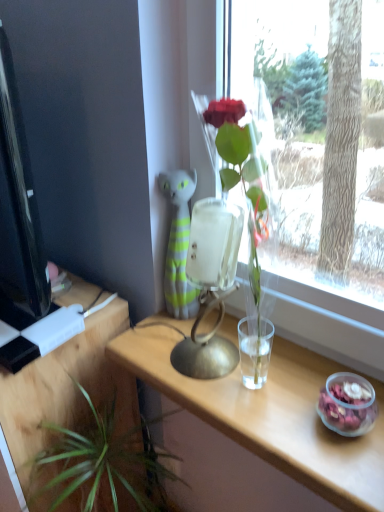
Question: Based on their positions, is black glossy computer monitor at left located to the left or right of clear wood table at center, the 2th table viewed from the left?

Choices:
 (A) left
 (B) right

Answer: (A)

Question: Considering the positions of point (23, 197) and point (292, 445), is point (23, 197) closer or farther from the camera than point (292, 445)?

Choices:
 (A) farther
 (B) closer

Answer: (A)

Question: Estimate the real-world distances between objects in this image. Which object is closer to the green leafy plant at lower left?

Choices:
 (A) wooden table at lower left, the 2th table when ordered from right to left
 (B) clear wood table at center, the 1th table from the right
 (C) black glossy computer monitor at left
 (D) metallic gold table lamp at center

Answer: (A)

Question: Which object is the farthest from the metallic gold table lamp at center?

Choices:
 (A) clear wood table at center, the 1th table from the right
 (B) green leafy plant at lower left
 (C) black glossy computer monitor at left
 (D) wooden table at lower left, the 1th table in the left-to-right sequence

Answer: (C)